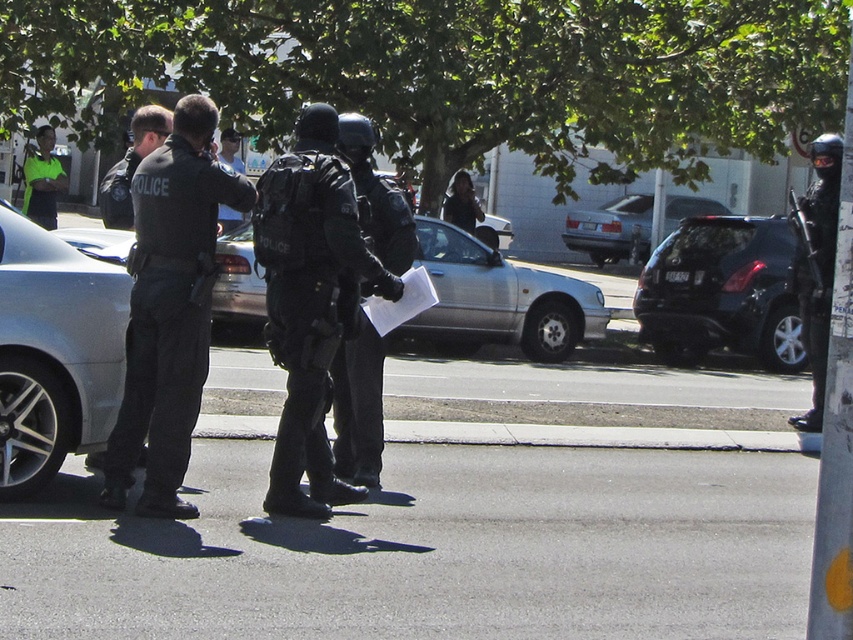
You are a photographer taking a picture of the street scene. You want to focus on the point closer to the camera. Which point should you choose between point (106, 465) and point (840, 141)?

Point (106, 465) is closer to the camera than point (840, 141), so you should choose point (106, 465) to focus on the closer point.

You are a delivery person who needs to load a large package onto a cart. The cart can only hold items that are shorter than the silver metallic car at center. Can you safely place the black tactical gear at right on the cart?

The silver metallic car at center is much taller than the black tactical gear at right. Since the cart can only hold items shorter than the car, the black tactical gear at right is shorter and can be safely placed on the cart.